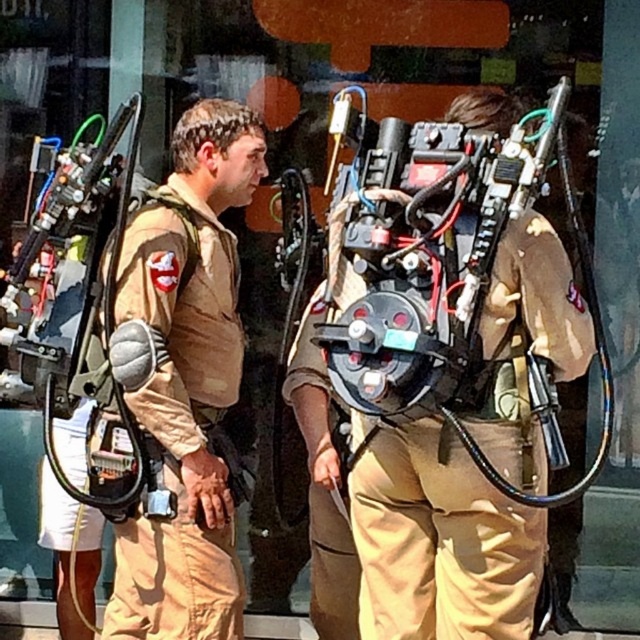
Can you confirm if tan fabric uniform at center is shorter than matte black backpack at center?

In fact, tan fabric uniform at center may be taller than matte black backpack at center.

How much distance is there between tan fabric uniform at center and matte black backpack at center?

tan fabric uniform at center is 28.49 inches from matte black backpack at center.

Describe the element at coordinates (180, 316) in the screenshot. I see `tan fabric uniform at center` at that location.

Where is `tan fabric uniform at center`? Image resolution: width=640 pixels, height=640 pixels. tan fabric uniform at center is located at coordinates (180, 316).